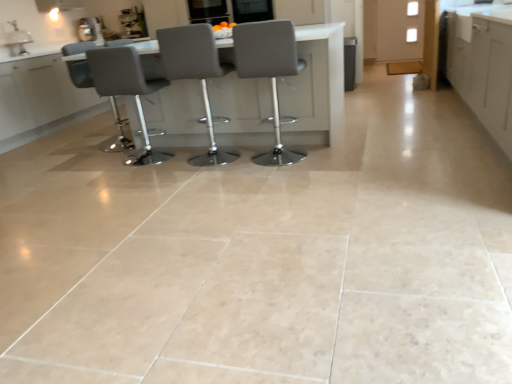
Question: Does point (9, 44) appear closer or farther from the camera than point (176, 79)?

Choices:
 (A) closer
 (B) farther

Answer: (B)

Question: Looking at the image, does white glossy sink at upper left seem bigger or smaller compared to matte gray chair at center, arranged as the second chair when viewed from the right?

Choices:
 (A) small
 (B) big

Answer: (A)

Question: Estimate the real-world distances between objects in this image. Which object is closer to the white glossy sink at upper left?

Choices:
 (A) white matte cabinet at right, arranged as the 2th cabinetry when viewed from the back
 (B) matte gray table at center
 (C) matte gray chair at center, arranged as the second chair when viewed from the right
 (D) gray leather stool at center, placed as the 4th chair when sorted from left to right
 (E) matte gray chair at center, which ranks as the third chair in right-to-left order

Answer: (E)

Question: Which of these objects is positioned farthest from the matte gray chair at center, which is the 3th chair from left to right?

Choices:
 (A) gray leather stool at center, the 1th chair from the right
 (B) matte gray table at center
 (C) metallic silver coffee machine at upper left
 (D) matte gray chair at left, the 4th chair positioned from the right
 (E) white glossy sink at upper left

Answer: (E)